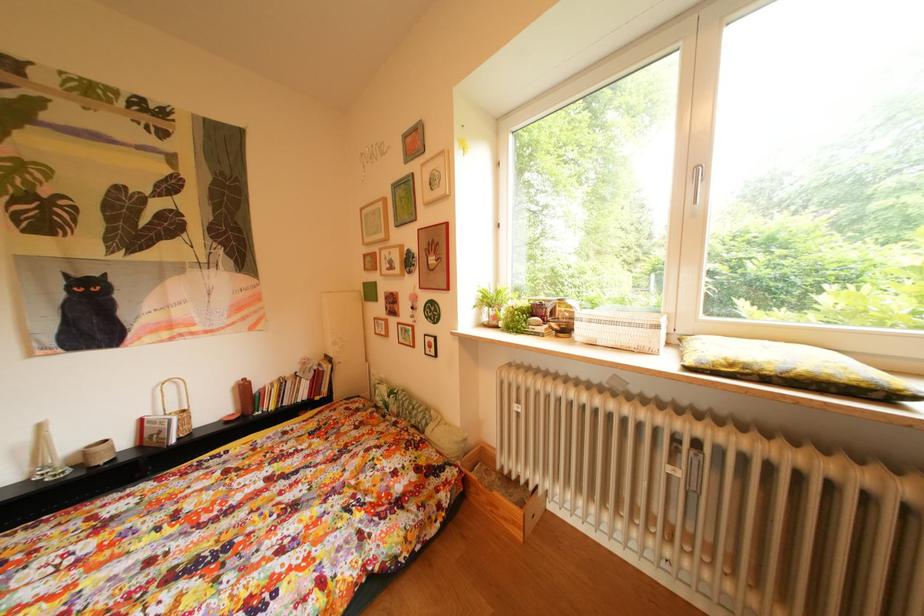
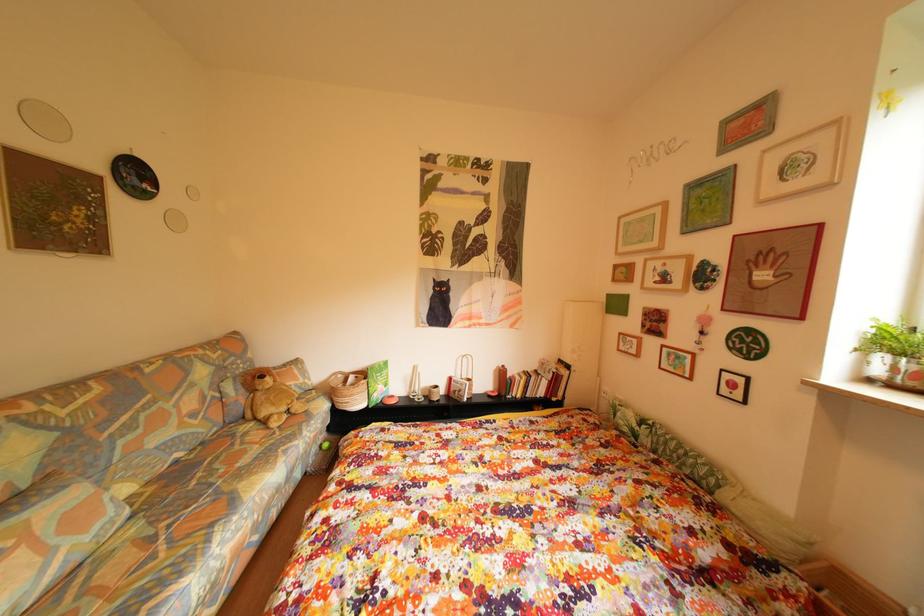
Question: Based on the continuous images, in which direction is the camera rotating? Reply with the corresponding letter.

Choices:
 (A) Left
 (B) Right
 (C) Up
 (D) Down

Answer: (A)